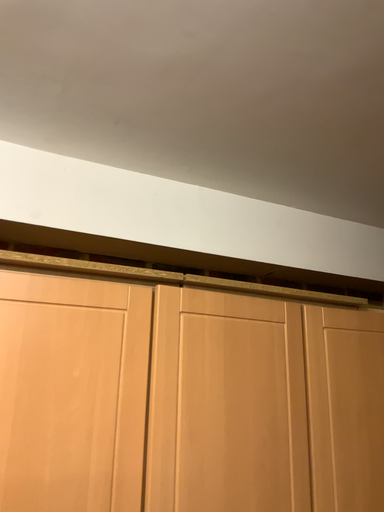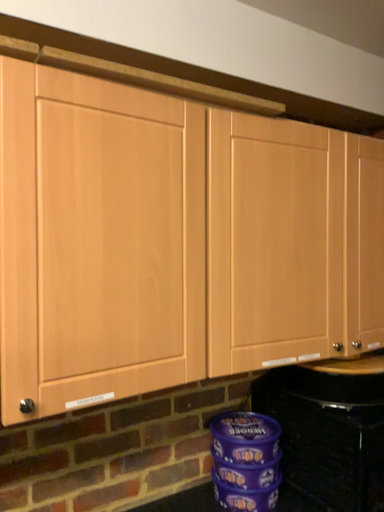
Question: How did the camera likely rotate when shooting the video?

Choices:
 (A) rotated left
 (B) rotated right

Answer: (B)